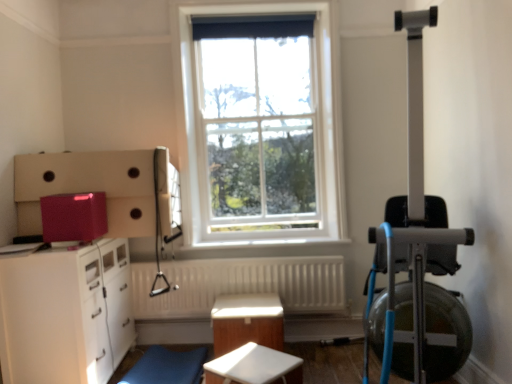
Identify the location of blue fabric swivel chair at lower center. (167, 367).

Measure the distance between point (208, 242) and camera.

The distance of point (208, 242) from camera is 3.26 meters.

Measure the distance between point (263, 371) and camera.

The depth of point (263, 371) is 6.66 feet.

How much space does white matte table at center, placed as the 1th table when sorted from front to back, occupy vertically?

It is 10.62 inches.

Where is `white textured radiator at center`? This screenshot has width=512, height=384. white textured radiator at center is located at coordinates (241, 285).

Where is `matte pink cabinet at left`? This screenshot has height=384, width=512. matte pink cabinet at left is located at coordinates (89, 187).

Is white textured radiator at center next to white glass window at center?

No, white textured radiator at center is not in contact with white glass window at center.

Is white textured radiator at center oriented towards white glass window at center?

No, white textured radiator at center is not facing towards white glass window at center.

This screenshot has height=384, width=512. Find the location of `window lying on the right of white textured radiator at center`. window lying on the right of white textured radiator at center is located at coordinates (261, 130).

Is white textured radiator at center bigger or smaller than white glass window at center?

In the image, white textured radiator at center appears to be smaller than white glass window at center.

Can you confirm if blue fabric swivel chair at lower center is taller than white glossy cabinet at lower left?

No.

Who is smaller, blue fabric swivel chair at lower center or white glossy cabinet at lower left?

blue fabric swivel chair at lower center.

Which is closer to the camera, [141,383] or [90,335]?

Point [90,335]

Between matte pink cabinet at left and blue fabric swivel chair at lower center, which one has smaller size?

Smaller between the two is blue fabric swivel chair at lower center.

Between matte pink cabinet at left and blue fabric swivel chair at lower center, which one has smaller width?

Thinner between the two is blue fabric swivel chair at lower center.

This screenshot has width=512, height=384. I want to click on swivel chair below the matte pink cabinet at left (from a real-world perspective), so click(x=167, y=367).

Looking at this image, which object is more forward, blue fabric swivel chair at lower center or white glossy table at center, the 1th table viewed from the back?

blue fabric swivel chair at lower center is closer to the camera.

Identify the location of swivel chair that is in front of the white glossy table at center, the 1th table viewed from the back. (167, 367).

Which object is positioned more to the left, blue fabric swivel chair at lower center or white glossy table at center, which ranks as the 2th table in front-to-back order?

blue fabric swivel chair at lower center is more to the left.

Can you confirm if blue fabric swivel chair at lower center is taller than white glossy table at center, which ranks as the 2th table in front-to-back order?

In fact, blue fabric swivel chair at lower center may be shorter than white glossy table at center, which ranks as the 2th table in front-to-back order.

Looking at the image, does white glass window at center seem bigger or smaller compared to blue fabric swivel chair at lower center?

Clearly, white glass window at center is larger in size than blue fabric swivel chair at lower center.

Are white glass window at center and blue fabric swivel chair at lower center beside each other?

No.

Is white glass window at center to the right of blue fabric swivel chair at lower center from the viewer's perspective?

Indeed, white glass window at center is positioned on the right side of blue fabric swivel chair at lower center.

From the picture: Is white glossy cabinet at lower left positioned before white matte table at center, placed as the 1th table when sorted from front to back?

No, it is behind white matte table at center, placed as the 1th table when sorted from front to back.

From the image's perspective, is white glossy cabinet at lower left on top of white matte table at center, placed as the 1th table when sorted from front to back?

Indeed, from the image's perspective, white glossy cabinet at lower left is shown above white matte table at center, placed as the 1th table when sorted from front to back.

Can you confirm if white glossy cabinet at lower left is bigger than white matte table at center, marked as the second table in a back-to-front arrangement?

Yes.

Considering the sizes of objects white matte table at center, placed as the 1th table when sorted from front to back, and blue fabric swivel chair at lower center in the image provided, who is thinner, white matte table at center, placed as the 1th table when sorted from front to back, or blue fabric swivel chair at lower center?

Thinner between the two is white matte table at center, placed as the 1th table when sorted from front to back.

From a real-world perspective, between white matte table at center, placed as the 1th table when sorted from front to back, and blue fabric swivel chair at lower center, who is vertically higher?

From a 3D spatial view, white matte table at center, placed as the 1th table when sorted from front to back, is above.

Which is nearer, (248, 356) or (129, 373)?

Point (248, 356) is positioned closer to the camera compared to point (129, 373).

At what (x,y) coordinates should I click in order to perform the action: click on radiator on the left of white glass window at center. Please return your answer as a coordinate pair (x, y). The height and width of the screenshot is (384, 512). Looking at the image, I should click on (241, 285).

Locate an element on the screen. The height and width of the screenshot is (384, 512). swivel chair below the white glossy cabinet at lower left (from a real-world perspective) is located at coordinates (167, 367).

When comparing their distances from white glossy cabinet at lower left, does blue fabric swivel chair at lower center or glossy plastic container at upper left seem further?

Based on the image, blue fabric swivel chair at lower center appears to be further to white glossy cabinet at lower left.

Considering their positions, is white glass window at center positioned closer to white matte table at center, placed as the 1th table when sorted from front to back, than white glossy cabinet at lower left?

Among the two, white glossy cabinet at lower left is located nearer to white matte table at center, placed as the 1th table when sorted from front to back.

Which object lies nearer to the anchor point white textured radiator at center, matte pink cabinet at left or white matte table at center, marked as the second table in a back-to-front arrangement?

matte pink cabinet at left lies closer to white textured radiator at center than the other object.

Considering their positions, is blue fabric swivel chair at lower center positioned further to white glossy table at center, the 1th table viewed from the back, than white textured radiator at center?

blue fabric swivel chair at lower center is further to white glossy table at center, the 1th table viewed from the back.

In the scene shown: When comparing their distances from white glossy table at center, which ranks as the 2th table in front-to-back order, does glossy plastic container at upper left or blue fabric swivel chair at lower center seem closer?

blue fabric swivel chair at lower center lies closer to white glossy table at center, which ranks as the 2th table in front-to-back order, than the other object.

Based on their spatial positions, is white glossy cabinet at lower left or white textured radiator at center closer to white matte table at center, placed as the 1th table when sorted from front to back?

white glossy cabinet at lower left.

Which object lies nearer to the anchor point white glossy table at center, which ranks as the 2th table in front-to-back order, white glass window at center or blue fabric swivel chair at lower center?

Answer: The object closer to white glossy table at center, which ranks as the 2th table in front-to-back order, is blue fabric swivel chair at lower center.

In the scene shown: Which object lies nearer to the anchor point matte pink cabinet at left, white matte table at center, placed as the 1th table when sorted from front to back, or glossy plastic container at upper left?

glossy plastic container at upper left.

What are the coordinates of `appliance between white glass window at center and blue fabric swivel chair at lower center in the vertical direction` in the screenshot? It's located at (74, 217).

You are a GUI agent. You are given a task and a screenshot of the screen. Output one action in this format:
    pyautogui.click(x=<x>, y=<y>)
    Task: Click on the cabinetry that lies between white glass window at center and blue fabric swivel chair at lower center from top to bottom
    
    Given the screenshot: What is the action you would take?
    pyautogui.click(x=89, y=187)

Image resolution: width=512 pixels, height=384 pixels. Identify the location of cabinetry between glossy plastic container at upper left and white textured radiator at center in the horizontal direction. (89, 187).

Where is `cabinetry between glossy plastic container at upper left and white matte table at center, marked as the second table in a back-to-front arrangement, from left to right`? cabinetry between glossy plastic container at upper left and white matte table at center, marked as the second table in a back-to-front arrangement, from left to right is located at coordinates (89, 187).